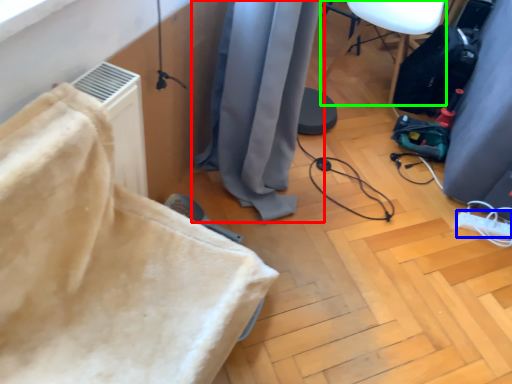
Question: Based on their relative distances, which object is farther from curtain (highlighted by a red box)? Choose from extension cord (highlighted by a blue box) and furniture (highlighted by a green box).

Choices:
 (A) extension cord
 (B) furniture

Answer: (A)